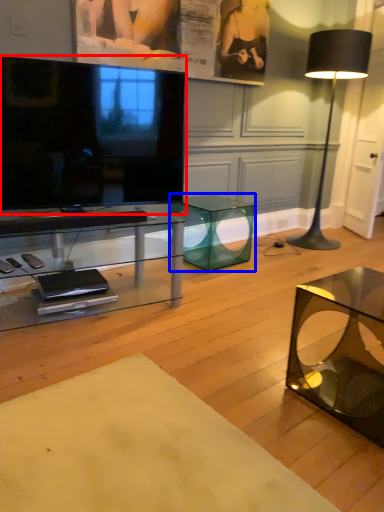
Question: Which point is further to the camera, television (highlighted by a red box) or table (highlighted by a blue box)?

Choices:
 (A) television
 (B) table

Answer: (B)